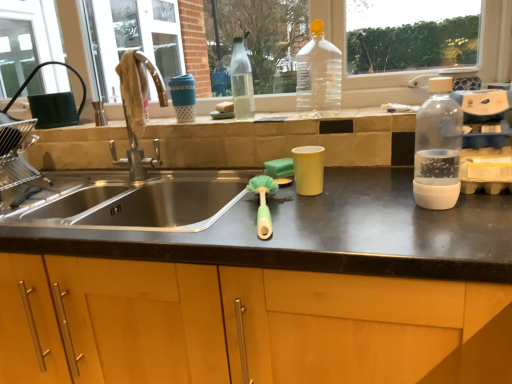
Question: In terms of size, does green sponge at center appear bigger or smaller than wooden cabinet at center?

Choices:
 (A) small
 (B) big

Answer: (A)

Question: From the image's perspective, relative to wooden cabinet at center, is green sponge at center above or below?

Choices:
 (A) below
 (B) above

Answer: (B)

Question: Considering the real-world distances, which object is closest to the wooden cabinet at center?

Choices:
 (A) transparent plastic bottle at center, acting as the third bottle starting from the front
 (B) stainless steel sink at center
 (C) transparent plastic bottle at upper center, which appears as the second bottle when viewed from the right
 (D) green sponge at center
 (E) green rubber brush at center

Answer: (E)

Question: Based on their relative distances, which object is nearer to the transparent plastic bottle at right, the first bottle from the right?

Choices:
 (A) stainless steel sink at center
 (B) green sponge at center
 (C) transparent plastic bottle at center, the 1th bottle positioned from the left
 (D) transparent plastic bottle at upper center, which appears as the 2th bottle when viewed from the back
 (E) wooden cabinet at center

Answer: (B)